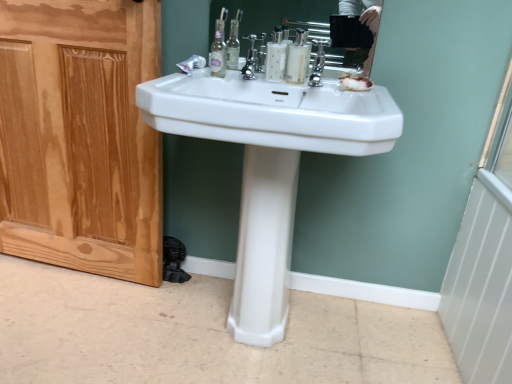
Locate an element on the screen. vacant space in natural wood screen door at left (from a real-world perspective) is located at coordinates (75, 273).